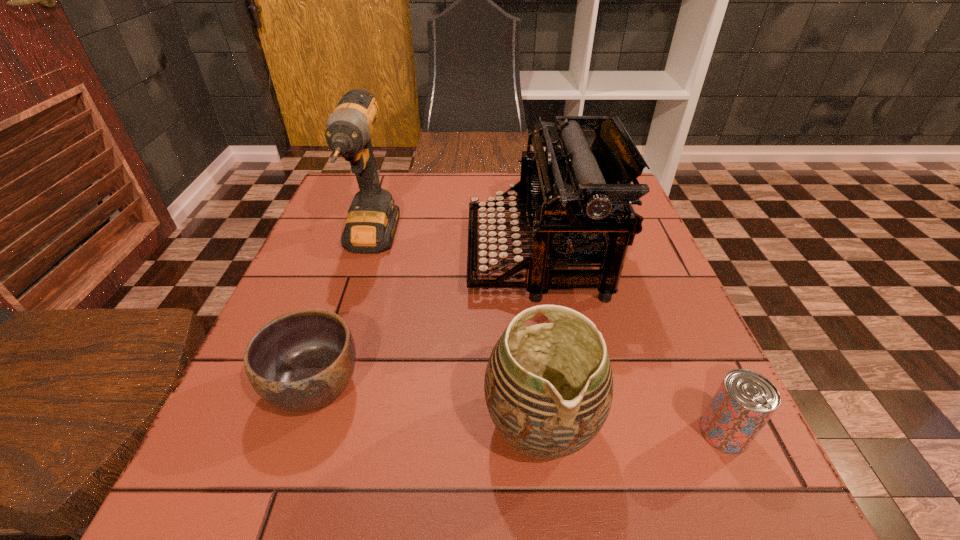
I want to click on free space located on the right of the bowl, so click(495, 386).

In order to click on free space located on the back of the beer can in this screenshot , I will do `click(652, 272)`.

Where is `drill situated at the far edge`? Image resolution: width=960 pixels, height=540 pixels. drill situated at the far edge is located at coordinates (372, 219).

You are a GUI agent. You are given a task and a screenshot of the screen. Output one action in this format:
    pyautogui.click(x=<x>, y=<y>)
    Task: Click on the typewriter that is at the far edge
    The height and width of the screenshot is (540, 960).
    Given the screenshot: What is the action you would take?
    pyautogui.click(x=576, y=196)

The width and height of the screenshot is (960, 540). Find the location of `object that is at the near edge`. object that is at the near edge is located at coordinates (548, 387).

Where is `drill present at the left edge`? Image resolution: width=960 pixels, height=540 pixels. drill present at the left edge is located at coordinates (372, 219).

Identify the location of bowl present at the left edge. This screenshot has width=960, height=540. (301, 361).

Identify the location of typewriter at the right edge. The height and width of the screenshot is (540, 960). (576, 196).

At what (x,y) coordinates should I click in order to perform the action: click on beer can that is at the right edge. Please return your answer as a coordinate pair (x, y). Looking at the image, I should click on (744, 402).

What are the coordinates of `object present at the far left corner` in the screenshot? It's located at (372, 219).